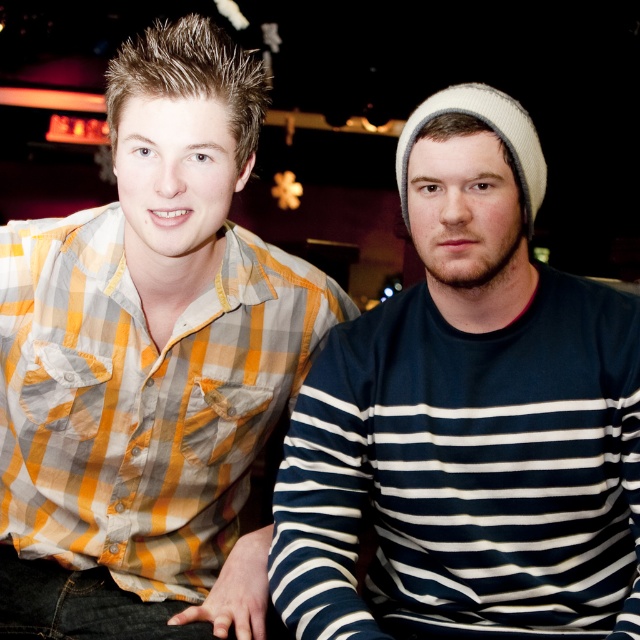
You are standing in front of a photo of two people at an event. There are two points marked in the image. The first point is at coordinates point (157, 99) and the second is at point (520, 604). Which point is nearer to you?

Point (157, 99) is closer to the viewer than point (520, 604).